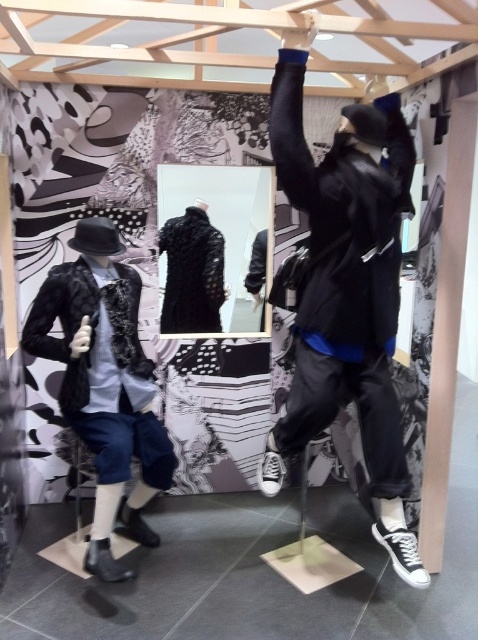
Is matte black jacket at upper right closer to camera compared to matte black jacket at left?

Yes.

Can you confirm if matte black jacket at upper right is wider than matte black jacket at left?

Yes, matte black jacket at upper right is wider than matte black jacket at left.

Between point (272, 435) and point (79, 314), which one is positioned in front?

Point (272, 435) is in front.

What are the coordinates of `matte black jacket at upper right` in the screenshot? It's located at (347, 289).